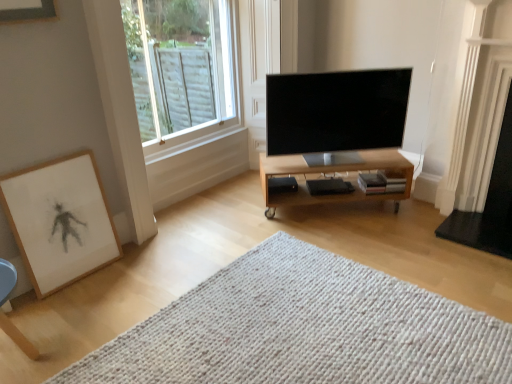
Question: Is light wood/finished table at center wider than wooden framed artwork at lower left?

Choices:
 (A) yes
 (B) no

Answer: (A)

Question: Could you tell me if light wood/finished table at center is facing wooden framed artwork at lower left?

Choices:
 (A) yes
 (B) no

Answer: (B)

Question: Is light wood/finished table at center at the left side of wooden framed artwork at lower left?

Choices:
 (A) no
 (B) yes

Answer: (A)

Question: Can you see light wood/finished table at center touching wooden framed artwork at lower left?

Choices:
 (A) no
 (B) yes

Answer: (A)

Question: Considering the relative sizes of light wood/finished table at center and wooden framed artwork at lower left in the image provided, is light wood/finished table at center smaller than wooden framed artwork at lower left?

Choices:
 (A) no
 (B) yes

Answer: (A)

Question: Considering the relative positions of white glossy fireplace at right and white knitted mat at center in the image provided, is white glossy fireplace at right to the left or to the right of white knitted mat at center?

Choices:
 (A) left
 (B) right

Answer: (B)

Question: From the image's perspective, is white glossy fireplace at right positioned above or below white knitted mat at center?

Choices:
 (A) below
 (B) above

Answer: (B)

Question: Considering the positions of white glossy fireplace at right and white knitted mat at center in the image, is white glossy fireplace at right wider or thinner than white knitted mat at center?

Choices:
 (A) wide
 (B) thin

Answer: (B)

Question: From a real-world perspective, is white glossy fireplace at right physically located above or below white knitted mat at center?

Choices:
 (A) above
 (B) below

Answer: (A)

Question: Considering the relative positions of clear glass window at upper left and white knitted mat at center in the image provided, is clear glass window at upper left to the left or to the right of white knitted mat at center?

Choices:
 (A) right
 (B) left

Answer: (B)

Question: Looking at their shapes, would you say clear glass window at upper left is wider or thinner than white knitted mat at center?

Choices:
 (A) wide
 (B) thin

Answer: (B)

Question: In the image, is clear glass window at upper left positioned in front of or behind white knitted mat at center?

Choices:
 (A) behind
 (B) front

Answer: (A)

Question: From the image's perspective, is clear glass window at upper left located above or below white knitted mat at center?

Choices:
 (A) above
 (B) below

Answer: (A)

Question: From a real-world perspective, relative to white glossy fireplace at right, is wooden framed artwork at lower left vertically above or below?

Choices:
 (A) above
 (B) below

Answer: (B)

Question: Is point (23, 210) closer or farther from the camera than point (490, 190)?

Choices:
 (A) farther
 (B) closer

Answer: (B)